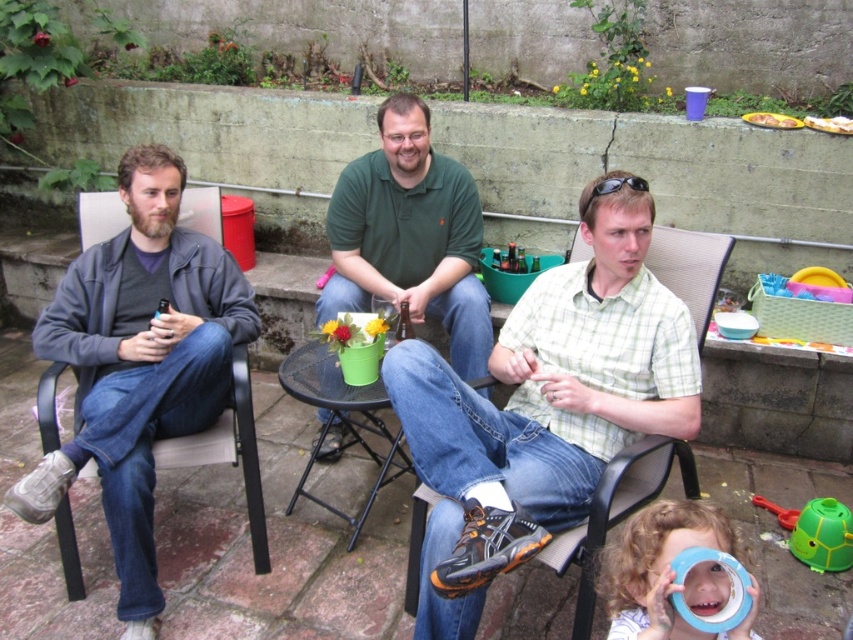
Question: Which object appears farthest from the camera in this image?

Choices:
 (A) green matte shirt at center
 (B) matte plastic chair at center
 (C) yellow plastic tray at upper center

Answer: (C)

Question: Is green matte shirt at center wider than matte plastic chair at center?

Choices:
 (A) yes
 (B) no

Answer: (A)

Question: Considering the real-world distances, which object is farthest from the yellow plastic tray at upper right?

Choices:
 (A) yellow plastic tray at upper center
 (B) green matte shirt at center
 (C) matte gray jacket at left

Answer: (C)

Question: Is matte gray jacket at left above green plastic table at center?

Choices:
 (A) no
 (B) yes

Answer: (B)

Question: Does matte plastic chair at center have a lesser width compared to yellow plastic tray at upper right?

Choices:
 (A) no
 (B) yes

Answer: (A)

Question: Which of the following is the farthest from the observer?

Choices:
 (A) (349, 444)
 (B) (653, 440)

Answer: (A)